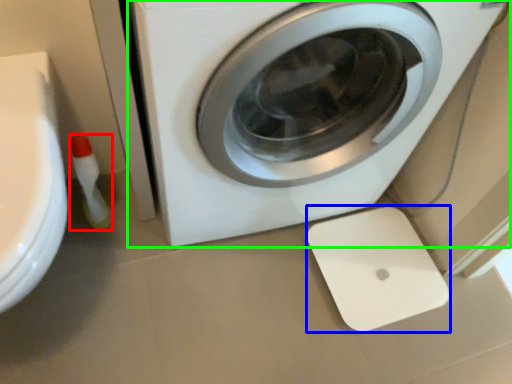
Question: Which object is positioned farthest from cleaning product (highlighted by a red box)? Select from appliance (highlighted by a blue box) and washing machine (highlighted by a green box).

Choices:
 (A) appliance
 (B) washing machine

Answer: (A)